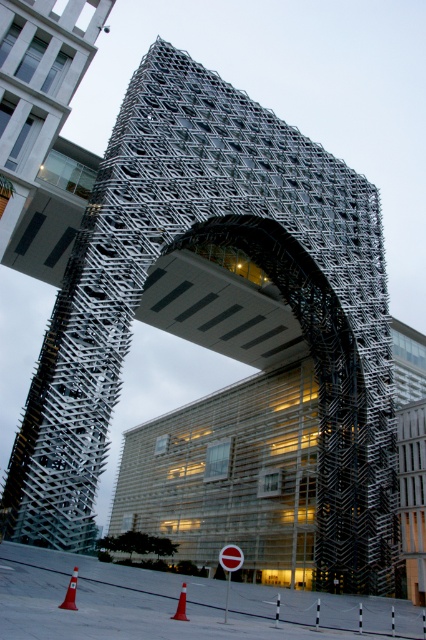
You are standing in front of the architectural structure and want to determine the relative positions of two points marked on the tower. Which point, point (68, 602) or point (180, 595), is closer to you?

Point (68, 602) is closer to the viewer than point (180, 595).

You are standing at the base of the tower and notice two points marked on the structure. The first point is at coordinate point (224, 561) and the second is at point (66, 589). Which point is closer to your current position?

Point (66, 589) is closer to your current position because it is in front of point (224, 561).

You are a delivery robot with a 3.28 feet wide base. You need to navigate through the path between the red matte stop sign at center and the orange plastic cone at lower center. Can your base fit through the path?

The distance between the red matte stop sign at center and orange plastic cone at lower center is 41.63 feet. Since your base is only 3.28 feet wide, it can easily fit through the path as the distance is significantly larger than your width.